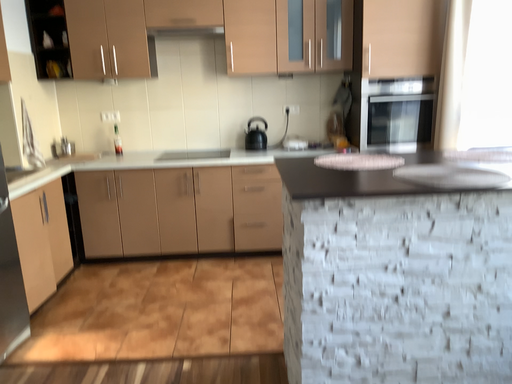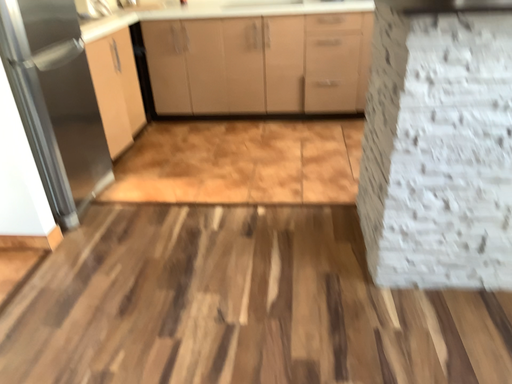
Question: How did the camera likely rotate when shooting the video?

Choices:
 (A) rotated left
 (B) rotated right

Answer: (A)